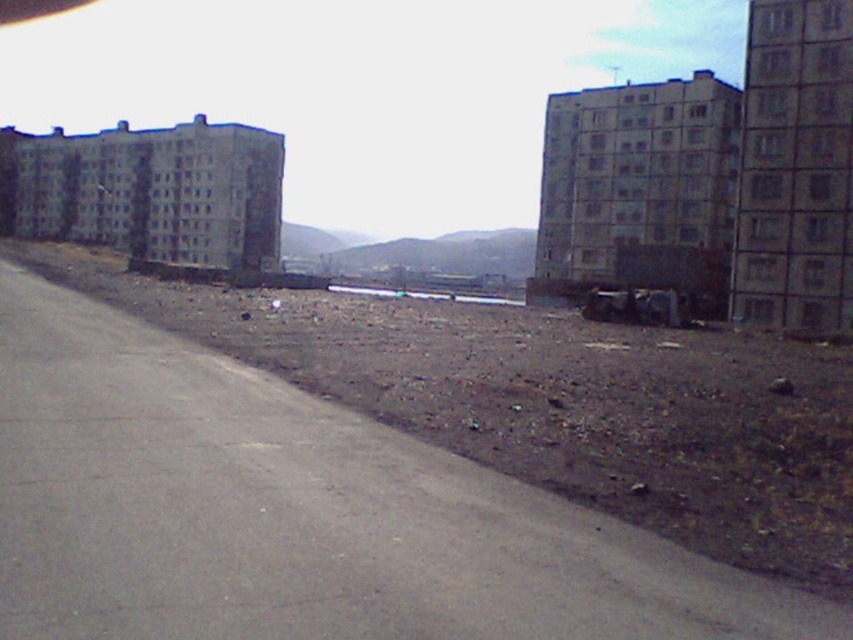
Which is below, brown dirt at lower left or gray concrete building at upper right?

brown dirt at lower left is lower down.

Which is behind, point (457, 422) or point (723, 100)?

The point (723, 100) is more distant.

At what (x,y) coordinates should I click in order to perform the action: click on brown dirt at lower left. Please return your answer as a coordinate pair (x, y). This screenshot has height=640, width=853. Looking at the image, I should click on (556, 403).